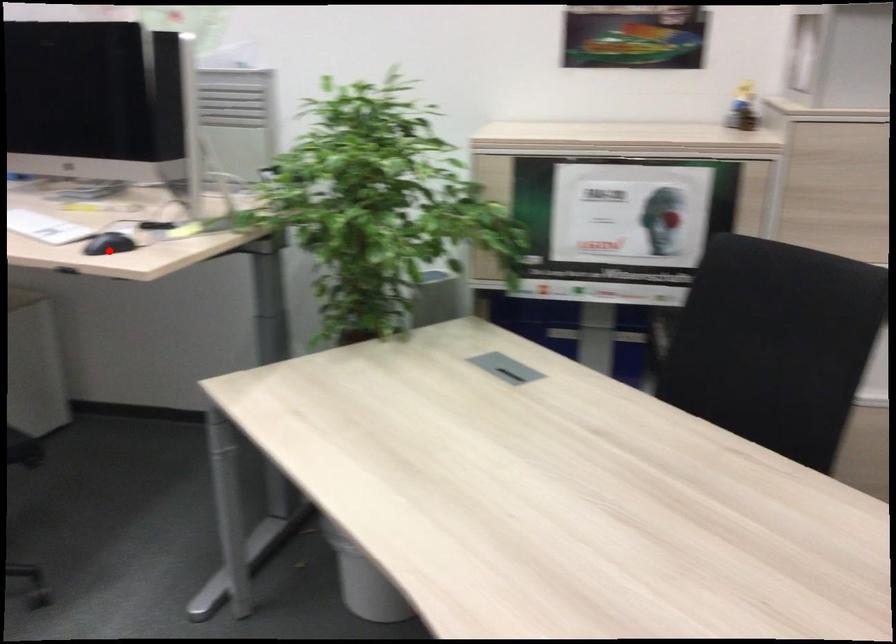
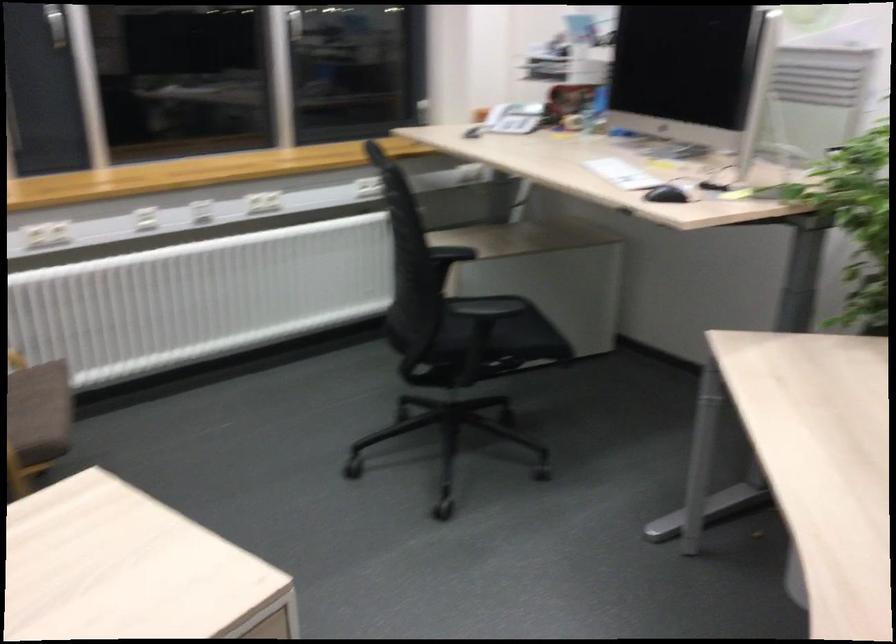
Find the pixel in the second image that matches the highlighted location in the first image.

(666, 194)